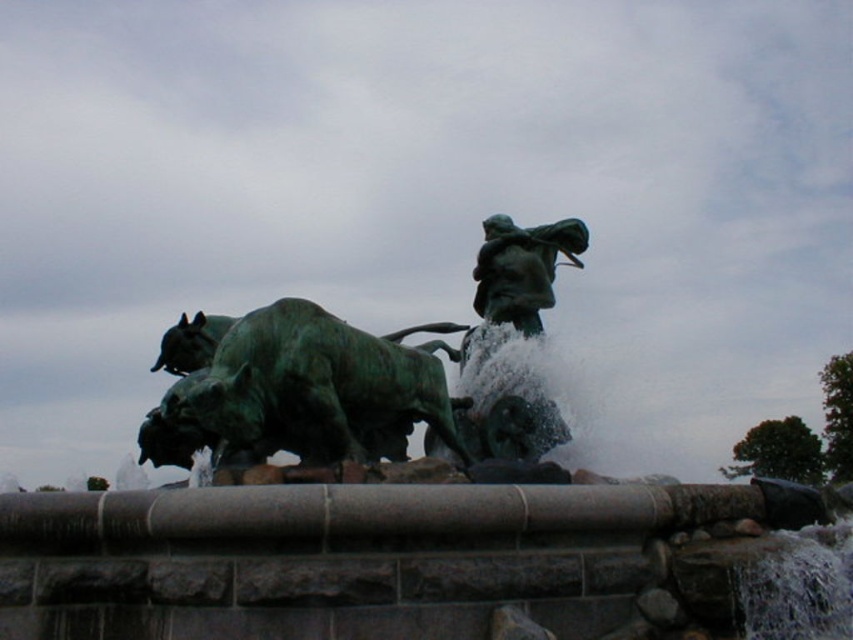
Question: Which object is positioned closest to the green patina bronze sculpture at center?

Choices:
 (A) green patina bull at center
 (B) green patina statue at center

Answer: (A)

Question: Does green patina statue at center have a larger size compared to green patina bull at center?

Choices:
 (A) no
 (B) yes

Answer: (B)

Question: Estimate the real-world distances between objects in this image. Which object is closer to the green patina bull at center?

Choices:
 (A) green patina bronze sculpture at center
 (B) green patina statue at center

Answer: (A)

Question: Is green patina statue at center positioned at the back of green patina bull at center?

Choices:
 (A) yes
 (B) no

Answer: (B)

Question: Based on their relative distances, which object is farther from the green patina statue at center?

Choices:
 (A) green patina bull at center
 (B) green patina bronze sculpture at center

Answer: (A)

Question: Does green patina statue at center have a smaller size compared to green patina bronze sculpture at center?

Choices:
 (A) no
 (B) yes

Answer: (A)